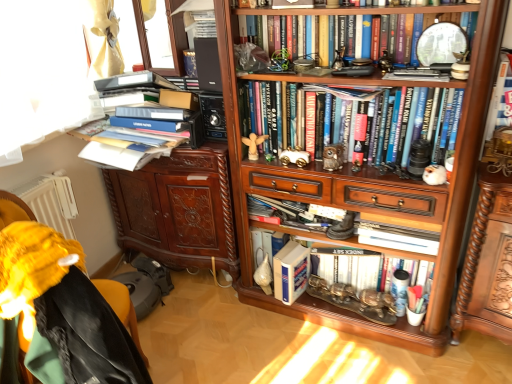
Identify the location of vacant area on top of blue matte book at upper left (from a real-world perspective). (150, 114).